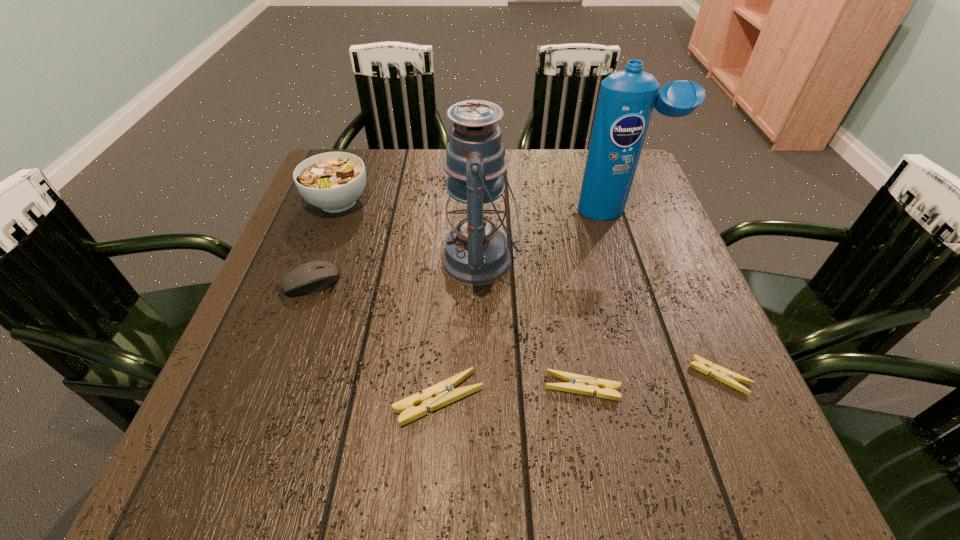
Find the location of a particular element. The height and width of the screenshot is (540, 960). the tallest clothespin is located at coordinates (443, 393).

The width and height of the screenshot is (960, 540). Identify the location of the leftmost clothespin. (443, 393).

The image size is (960, 540). I want to click on the fifth object from left to right, so click(x=579, y=384).

Locate an element on the screen. This screenshot has height=540, width=960. the sixth tallest object is located at coordinates (579, 384).

Locate an element on the screen. The height and width of the screenshot is (540, 960). the shortest clothespin is located at coordinates (728, 377).

Where is `the rightmost clothespin`? The image size is (960, 540). the rightmost clothespin is located at coordinates (728, 377).

Image resolution: width=960 pixels, height=540 pixels. I want to click on the fifth shortest object, so click(x=333, y=181).

Find the location of `shampoo`. shampoo is located at coordinates (626, 99).

Locate an element on the screen. computer equipment is located at coordinates (313, 276).

Image resolution: width=960 pixels, height=540 pixels. In order to click on lantern in this screenshot , I will do `click(476, 254)`.